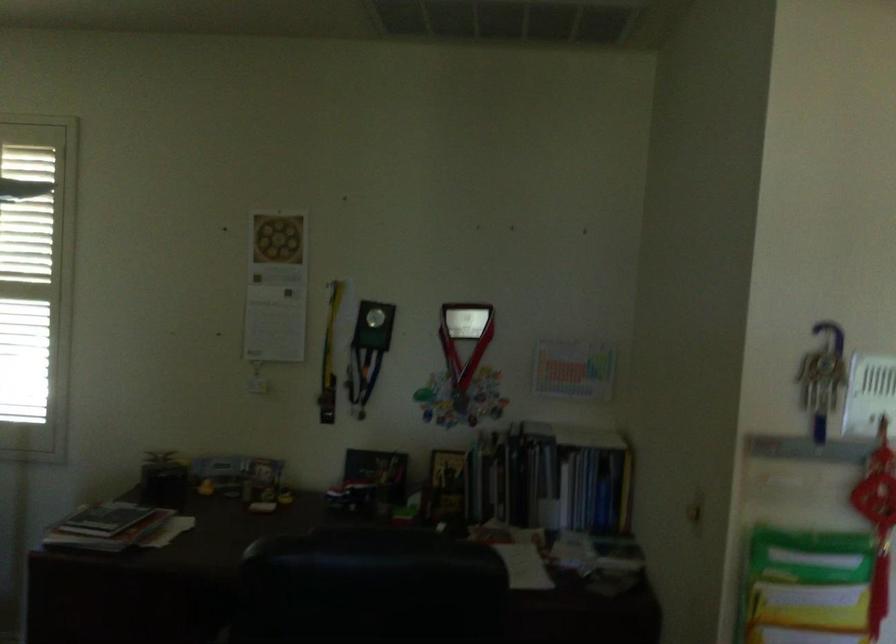
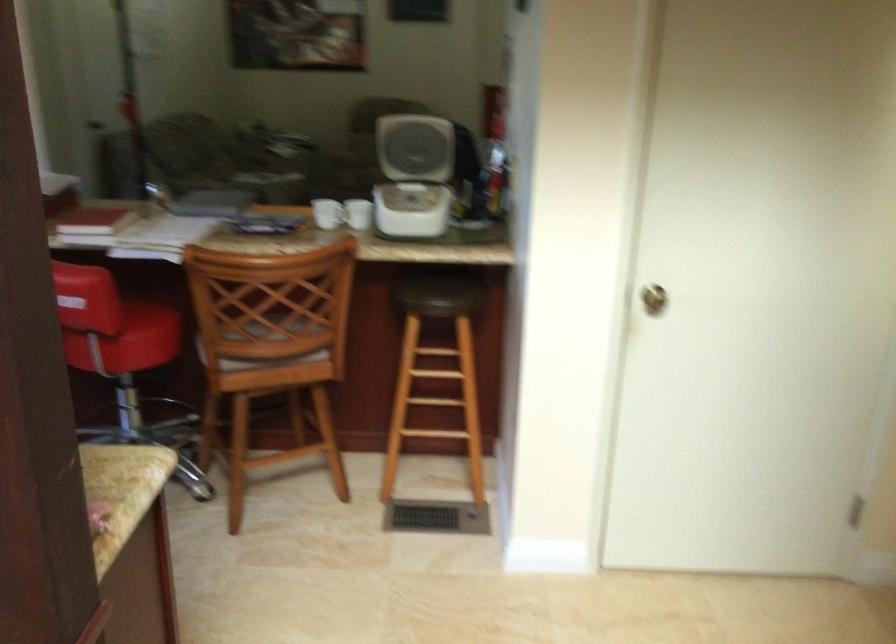
Question: I am providing you with two images of the same scene from different viewpoints. Which of the following objects are not visible in image2?

Choices:
 (A) book
 (B) blue pen cap
 (C) stool sitting surface
 (D) white coffee mug

Answer: (A)